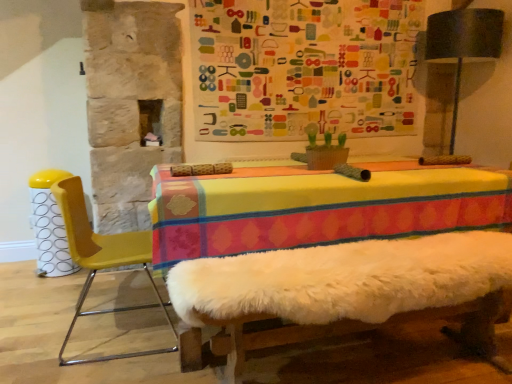
At what (x,y) coordinates should I click in order to perform the action: click on free space in front of yellow plastic bar stool at left. Please return your answer as a coordinate pair (x, y). Image resolution: width=512 pixels, height=384 pixels. Looking at the image, I should click on (39, 284).